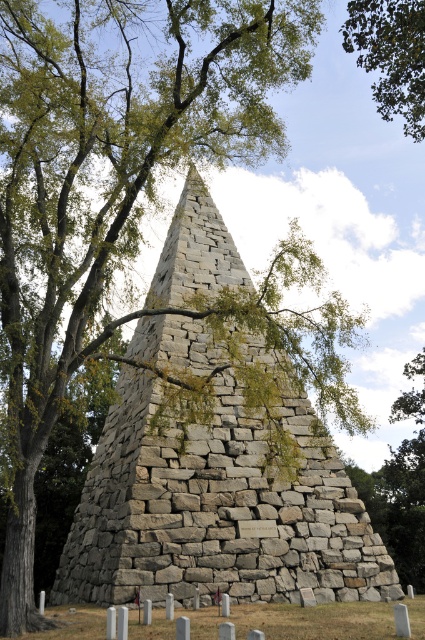
Which is in front, point (175, 397) or point (362, 1)?

Point (175, 397) is in front.

In the scene shown: Does gray stone pyramid at center appear over green leafy tree at upper right?

Actually, gray stone pyramid at center is below green leafy tree at upper right.

Is point (88, 490) positioned behind point (390, 16)?

No, it is not.

At what (x,y) coordinates should I click in order to perform the action: click on gray stone pyramid at center. Please return your answer as a coordinate pair (x, y). Image resolution: width=425 pixels, height=640 pixels. Looking at the image, I should click on (215, 508).